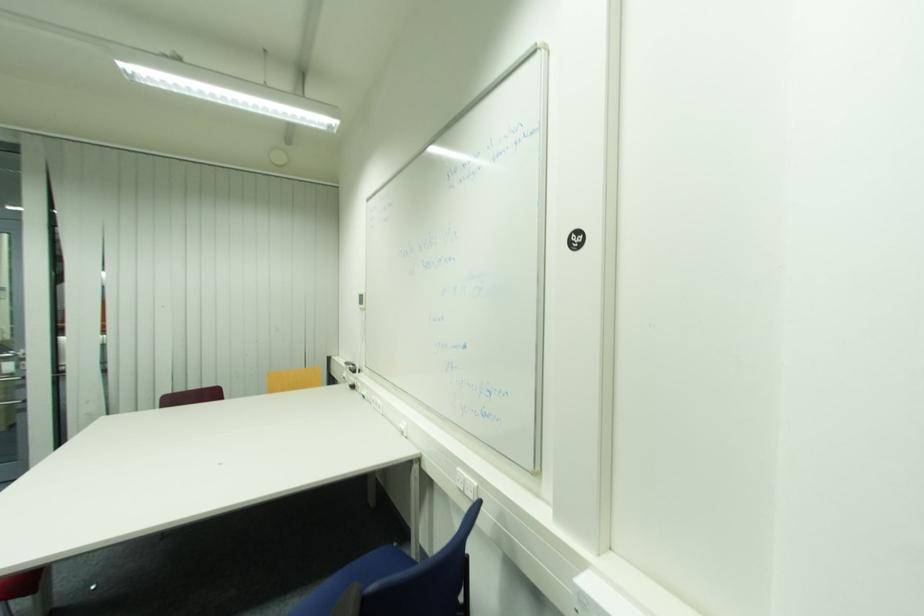
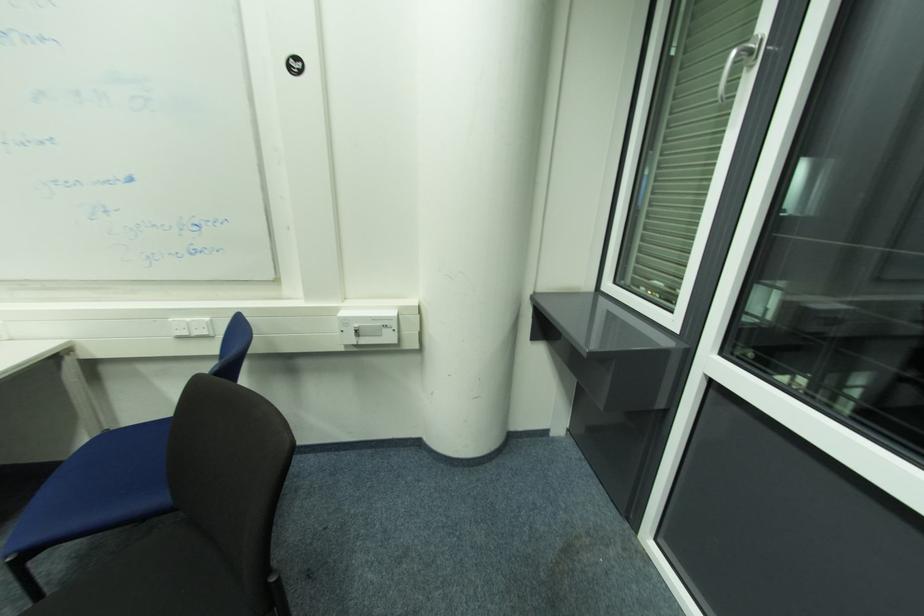
First-person continuous shooting, in which direction is the camera rotating?

The rotation direction of the camera is right-down.